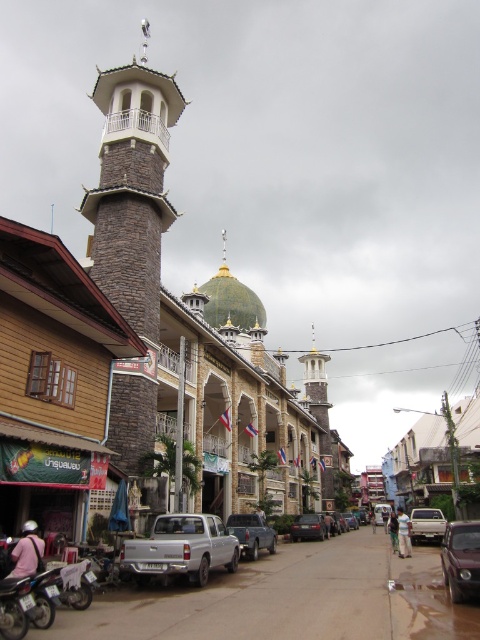
You are a pedestrian standing at the entrance of the mosque. You want to walk to the light blue fabric at center without stepping on the shiny dark brown car at lower right. Which direction should you walk to avoid it?

The shiny dark brown car at lower right is positioned on the left side of light blue fabric at center. To avoid stepping on it, you should walk to the right side of the light blue fabric at center.

You are a delivery person who needs to park your shiny black sedan at center in a spot that doesn not cover the white fabric shirt at center. Can you adjust your parking position to avoid covering it?

The shiny black sedan at center is currently positioned over the white fabric shirt at center. To avoid covering it, you should move the shiny black sedan at center either to the left or right so that it no longer overlaps with the white fabric shirt at center.

You are a delivery driver who needs to park your shiny black sedan at center in a parking spot located at coordinates point 0.825, 0.642. Is the parking spot directly under the mosque?

The shiny black sedan at center is located at point (308, 528), which is the same coordinates as the parking spot. Therefore, the parking spot is directly under the mosque where the shiny black sedan at center is parked.